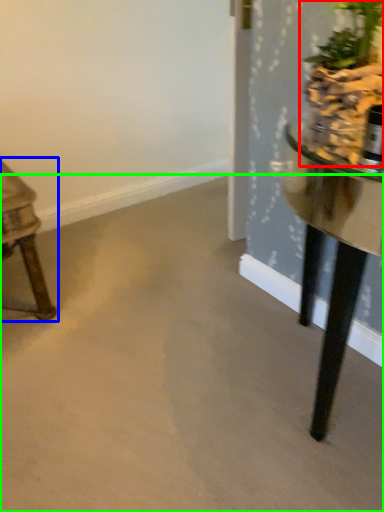
Question: Considering the real-world distances, which object is closest to houseplant (highlighted by a red box)? table (highlighted by a blue box) or concrete (highlighted by a green box).

Choices:
 (A) table
 (B) concrete

Answer: (B)